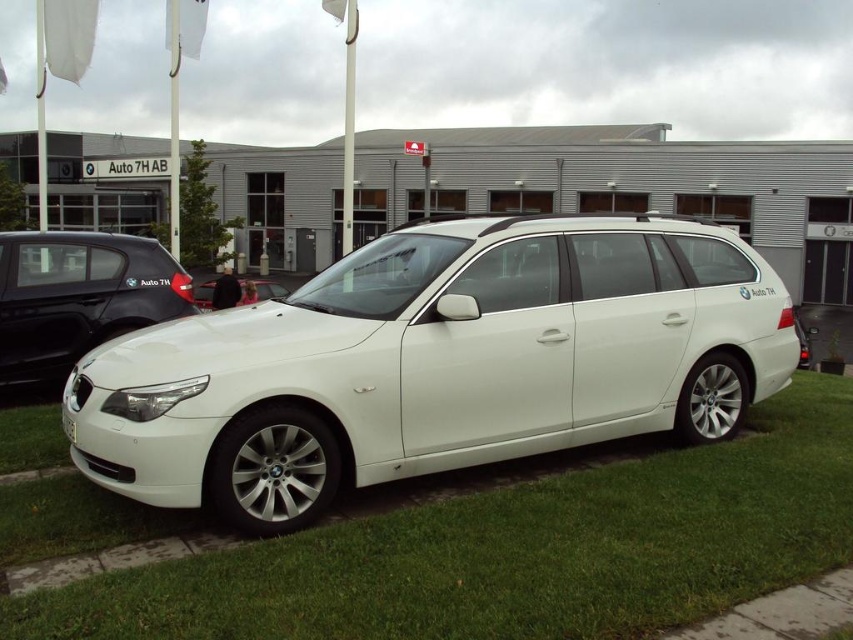
Question: Does white metallic car at center have a larger size compared to white metallic car at left?

Choices:
 (A) yes
 (B) no

Answer: (A)

Question: Which is farther from the green grass at lower center?

Choices:
 (A) white matte car at center
 (B) white metallic car at left
 (C) white metallic car at center

Answer: (A)

Question: Does white metallic car at center lie behind white metallic car at left?

Choices:
 (A) yes
 (B) no

Answer: (B)

Question: Which point is closer to the camera taking this photo?

Choices:
 (A) (122, 236)
 (B) (15, 529)

Answer: (B)

Question: Is white metallic car at left bigger than white matte car at center?

Choices:
 (A) yes
 (B) no

Answer: (B)

Question: Which of the following is the farthest from the observer?

Choices:
 (A) white matte car at center
 (B) white metallic car at left
 (C) white metallic car at center

Answer: (A)